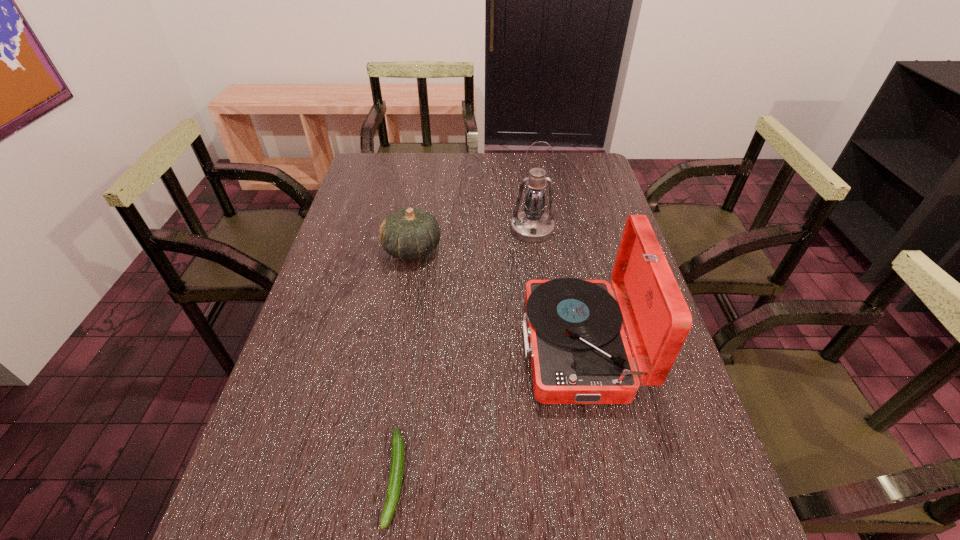
You are a GUI agent. You are given a task and a screenshot of the screen. Output one action in this format:
    pyautogui.click(x=<x>, y=<y>)
    Task: Click on the object situated at the left edge
    
    Given the screenshot: What is the action you would take?
    pyautogui.click(x=409, y=233)

You are a GUI agent. You are given a task and a screenshot of the screen. Output one action in this format:
    pyautogui.click(x=<x>, y=<y>)
    Task: Click on the object positioned at the right edge
    This screenshot has height=540, width=960.
    Given the screenshot: What is the action you would take?
    click(x=579, y=353)

The image size is (960, 540). In order to click on vacant point at the far edge in this screenshot , I will do `click(435, 180)`.

I want to click on vacant space at the left edge of the desktop, so click(321, 269).

The height and width of the screenshot is (540, 960). Find the location of `vacant space at the right edge`. vacant space at the right edge is located at coordinates (593, 278).

This screenshot has width=960, height=540. Find the location of `free space at the far left corner of the desktop`. free space at the far left corner of the desktop is located at coordinates (372, 165).

Find the location of a particular element. free region at the far right corner of the desktop is located at coordinates (599, 184).

At what (x,y) coordinates should I click in order to perform the action: click on free area in between the zucchini and the oil lamp. Please return your answer as a coordinate pair (x, y). This screenshot has width=960, height=540. Looking at the image, I should click on (464, 354).

The height and width of the screenshot is (540, 960). What are the coordinates of `empty space that is in between the second shortest object and the oil lamp` in the screenshot? It's located at point(472,240).

Identify the location of vacant area that lies between the shortest object and the oil lamp. (464, 354).